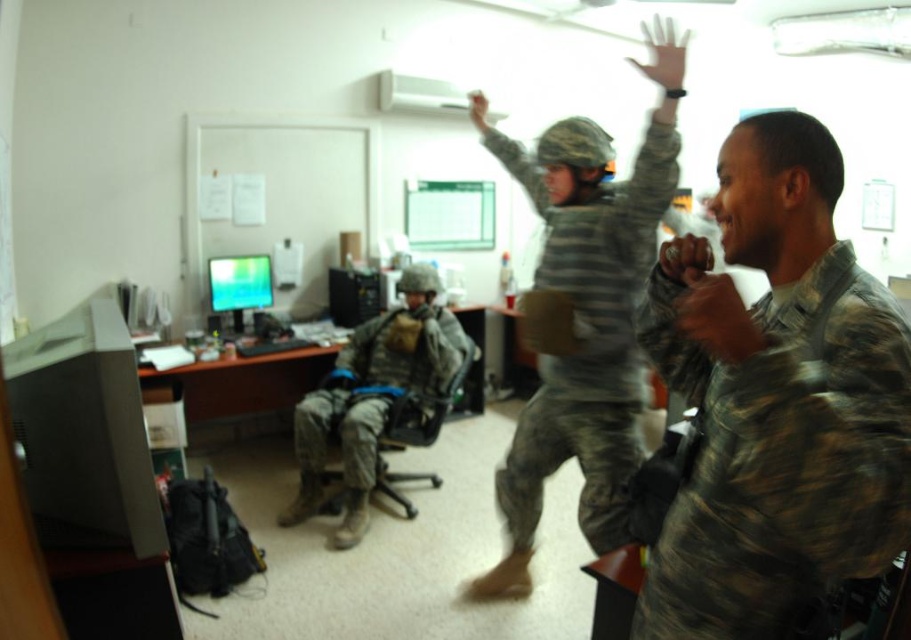
Between camouflage fabric soldier at center and camouflage uniform at center, which one has less height?

With less height is camouflage uniform at center.

At what (x,y) coordinates should I click in order to perform the action: click on camouflage fabric soldier at center. Please return your answer as a coordinate pair (x, y). The height and width of the screenshot is (640, 911). Looking at the image, I should click on (586, 314).

Who is taller, camouflagetextured fabric at right or camouflage uniform at center?

camouflage uniform at center is taller.

Is camouflagetextured fabric at right below camouflage uniform at center?

No.

Identify the location of camouflagetextured fabric at right. 781,456.

Is camouflagetextured fabric at right to the left of camouflage fabric soldier at center from the viewer's perspective?

Incorrect, camouflagetextured fabric at right is not on the left side of camouflage fabric soldier at center.

Can you confirm if camouflagetextured fabric at right is shorter than camouflage fabric soldier at center?

Yes.

Is point (783, 586) closer to camera compared to point (631, 195)?

Yes, point (783, 586) is closer to viewer.

Where is `camouflagetextured fabric at right`? The height and width of the screenshot is (640, 911). camouflagetextured fabric at right is located at coordinates (781, 456).